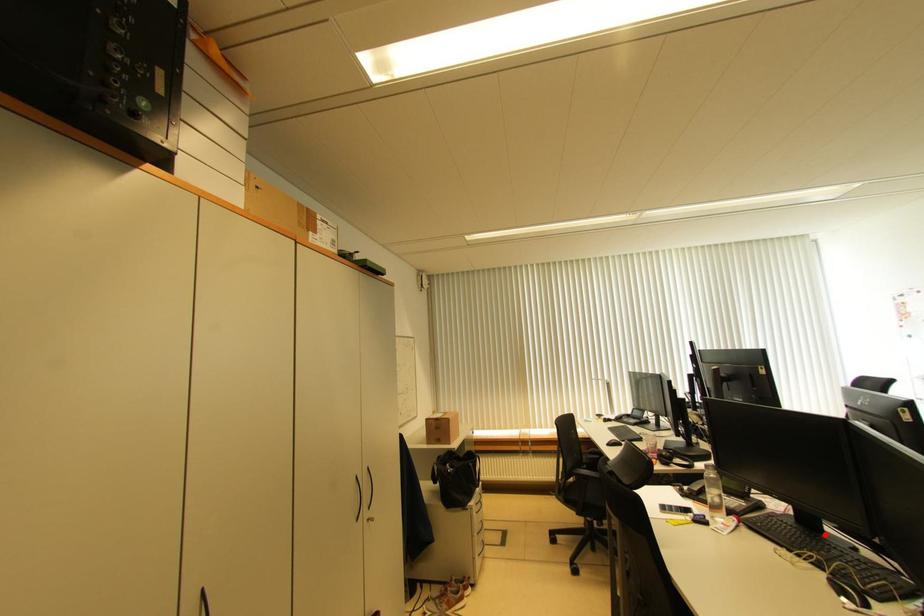
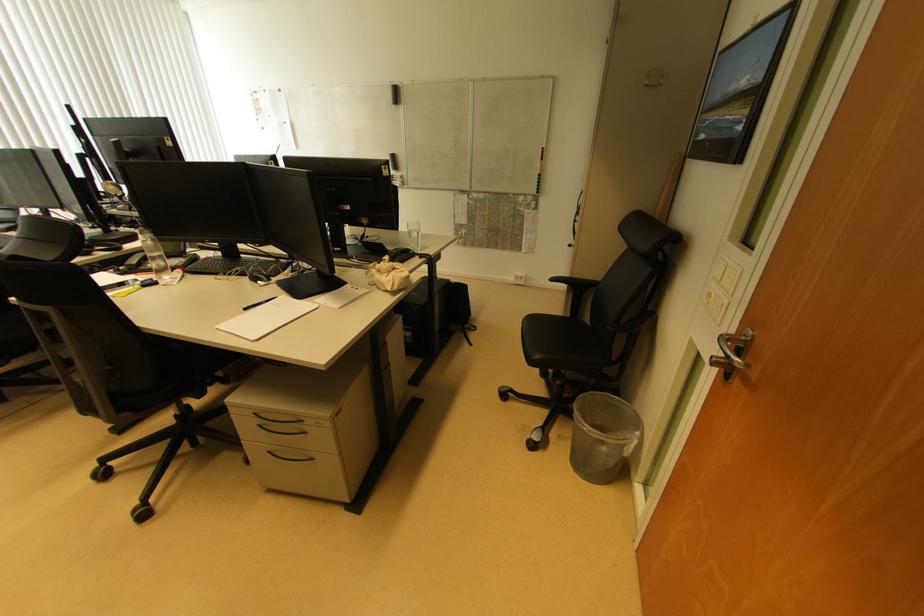
Question: A red point is marked in image1. In image2, is the corresponding 3D point closer to the camera or farther? Reply with the corresponding letter.

Choices:
 (A) The corresponding 3D point is closer.
 (B) The corresponding 3D point is farther.

Answer: (A)